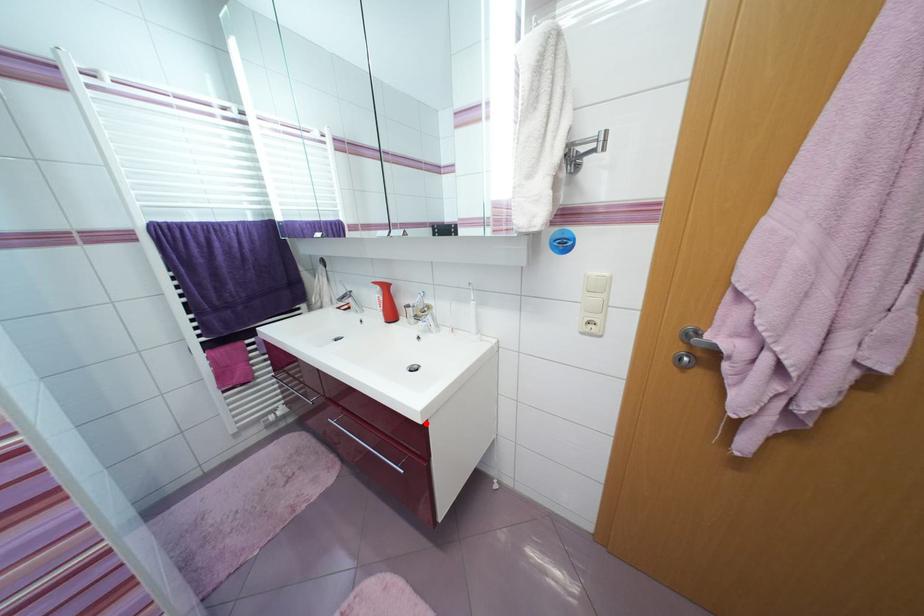
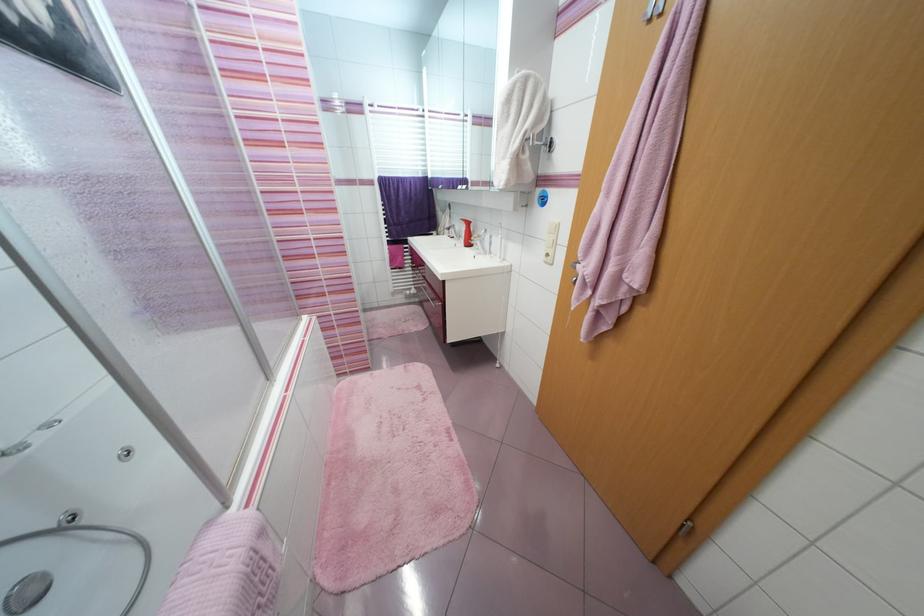
In the second image, find the point that corresponds to the highlighted location in the first image.

(445, 281)